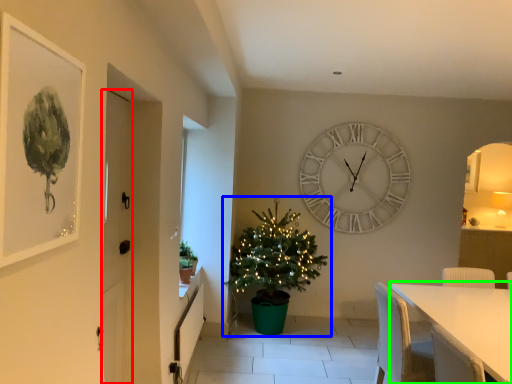
Question: Which object is positioned closest to door (highlighted by a red box)? Select from christmas tree (highlighted by a blue box) and table (highlighted by a green box).

Choices:
 (A) christmas tree
 (B) table

Answer: (B)